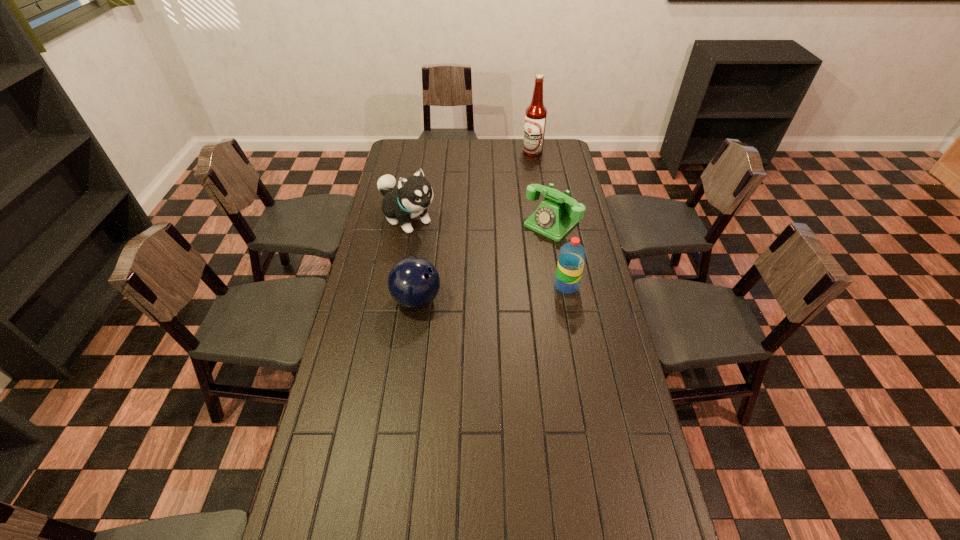
Identify the location of blank space that satisfies the following two spatial constraints: 1. on the front side of the bowling ball; 2. on the surface of the puppy near the finger holes. (393, 300).

Where is `free space that satisfies the following two spatial constraints: 1. on the front side of the puppy; 2. on the surface of the bowling ball near the finger holes`? The height and width of the screenshot is (540, 960). free space that satisfies the following two spatial constraints: 1. on the front side of the puppy; 2. on the surface of the bowling ball near the finger holes is located at coordinates (393, 300).